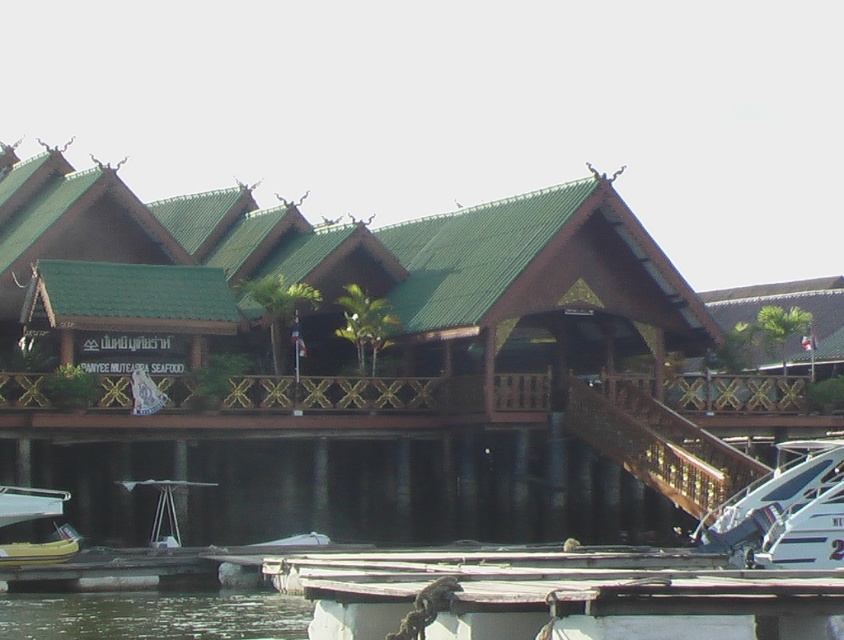
Question: Among these points, which one is nearest to the camera?

Choices:
 (A) (253, 230)
 (B) (80, 598)

Answer: (B)

Question: Is wooden hut at center below white matte boat at lower center?

Choices:
 (A) no
 (B) yes

Answer: (A)

Question: Is clear water at lower left below white plastic boat at lower left?

Choices:
 (A) yes
 (B) no

Answer: (A)

Question: Among these objects, which one is nearest to the camera?

Choices:
 (A) wooden hut at center
 (B) white plastic boat at lower left

Answer: (B)

Question: From the image, what is the correct spatial relationship of wooden hut at center in relation to white plastic boat at lower left?

Choices:
 (A) below
 (B) above

Answer: (B)

Question: Which point appears closest to the camera in this image?

Choices:
 (A) click(x=84, y=244)
 (B) click(x=161, y=627)

Answer: (B)